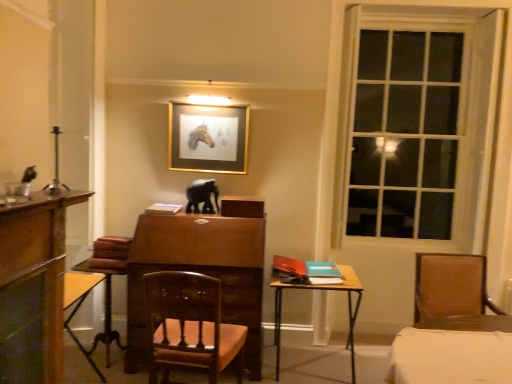
Question: Considering their positions, is wooden table at lower left, the 1th table in the left-to-right sequence, located in front of or behind white matte book at center?

Choices:
 (A) front
 (B) behind

Answer: (A)

Question: From their relative heights in the image, would you say wooden table at lower left, the second table when ordered from right to left, is taller or shorter than white matte book at center?

Choices:
 (A) tall
 (B) short

Answer: (A)

Question: Which of these objects is positioned farthest from the wooden polished chair at center, the first chair positioned from the left?

Choices:
 (A) clear glass window at right
 (B) brown leather chair at right, marked as the 1th chair in a right-to-left arrangement
 (C) black glossy elephant at center
 (D) gold metallic picture frame at upper center
 (E) wooden table at lower left, the second table when ordered from right to left

Answer: (A)

Question: Estimate the real-world distances between objects in this image. Which object is closer to the wooden table at center, which ranks as the 2th table in left-to-right order?

Choices:
 (A) clear glass window at right
 (B) black glossy elephant at center
 (C) wooden polished chair at center, the first chair positioned from the left
 (D) wooden table at lower left, the second table when ordered from right to left
 (E) white matte book at center

Answer: (C)